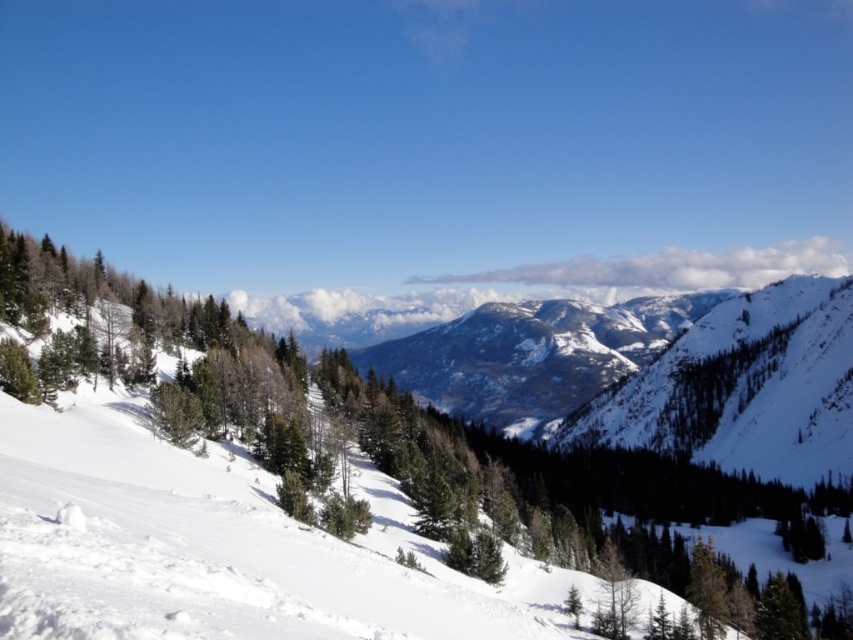
Question: Which of the following is the farthest from the observer?

Choices:
 (A) (230, 424)
 (B) (444, 365)

Answer: (B)

Question: Which point appears closest to the camera in this image?

Choices:
 (A) (654, 340)
 (B) (39, 448)

Answer: (B)

Question: From the image, what is the correct spatial relationship of green matte tree at center in relation to snowy rocky mountain at center?

Choices:
 (A) above
 (B) below

Answer: (B)

Question: Can you confirm if green matte tree at center is wider than snowy rocky mountain at center?

Choices:
 (A) yes
 (B) no

Answer: (B)

Question: Does green matte tree at center appear over snowy rocky mountain at center?

Choices:
 (A) no
 (B) yes

Answer: (A)

Question: Which point is closer to the camera?

Choices:
 (A) green matte tree at center
 (B) snowy rocky mountain at center

Answer: (A)